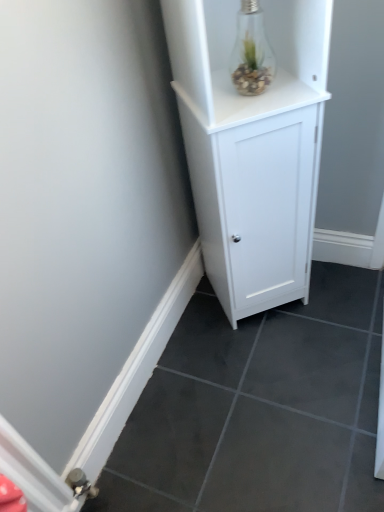
Question: Considering the relative sizes of transparent glass light bulb at upper right and white matte cabinet at center in the image provided, is transparent glass light bulb at upper right taller than white matte cabinet at center?

Choices:
 (A) no
 (B) yes

Answer: (A)

Question: Is transparent glass light bulb at upper right facing towards white matte cabinet at center?

Choices:
 (A) no
 (B) yes

Answer: (B)

Question: Is transparent glass light bulb at upper right completely or partially outside of white matte cabinet at center?

Choices:
 (A) no
 (B) yes

Answer: (A)

Question: Can you confirm if transparent glass light bulb at upper right is smaller than white matte cabinet at center?

Choices:
 (A) no
 (B) yes

Answer: (B)

Question: Can you confirm if transparent glass light bulb at upper right is positioned to the right of white matte cabinet at center?

Choices:
 (A) yes
 (B) no

Answer: (B)

Question: Would you consider transparent glass light bulb at upper right to be distant from white matte cabinet at center?

Choices:
 (A) yes
 (B) no

Answer: (B)

Question: Does white matte cabinet at center appear on the left side of transparent glass light bulb at upper right?

Choices:
 (A) yes
 (B) no

Answer: (B)

Question: Is white matte cabinet at center wider than transparent glass light bulb at upper right?

Choices:
 (A) yes
 (B) no

Answer: (A)

Question: Could you tell me if white matte cabinet at center is turned towards transparent glass light bulb at upper right?

Choices:
 (A) yes
 (B) no

Answer: (A)

Question: Is the position of white matte cabinet at center less distant than that of transparent glass light bulb at upper right?

Choices:
 (A) no
 (B) yes

Answer: (B)

Question: Considering the relative positions of white matte cabinet at center and transparent glass light bulb at upper right in the image provided, is white matte cabinet at center to the right of transparent glass light bulb at upper right from the viewer's perspective?

Choices:
 (A) yes
 (B) no

Answer: (A)

Question: From a real-world perspective, is white matte cabinet at center on top of transparent glass light bulb at upper right?

Choices:
 (A) yes
 (B) no

Answer: (B)

Question: From the image's perspective, is white matte cabinet at center positioned above or below transparent glass light bulb at upper right?

Choices:
 (A) above
 (B) below

Answer: (B)